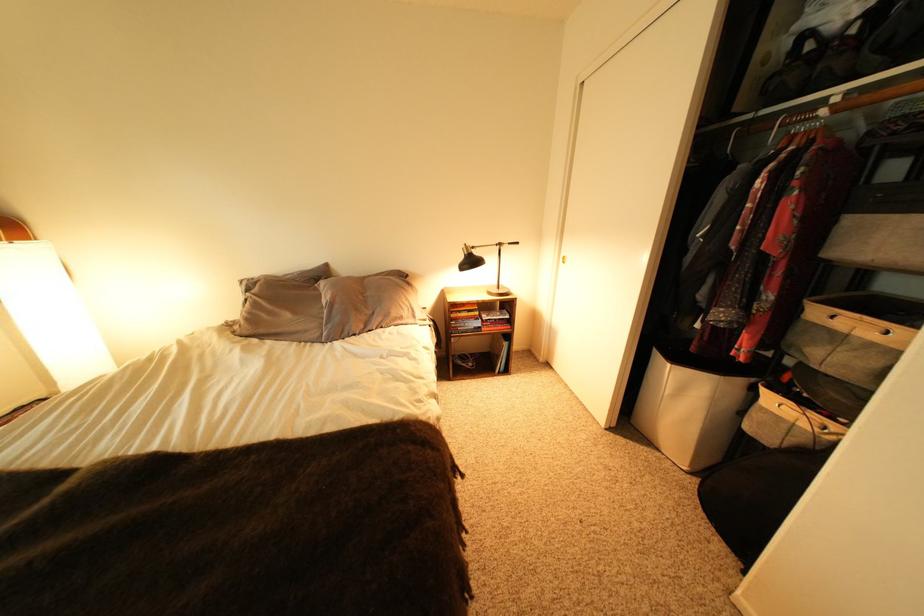
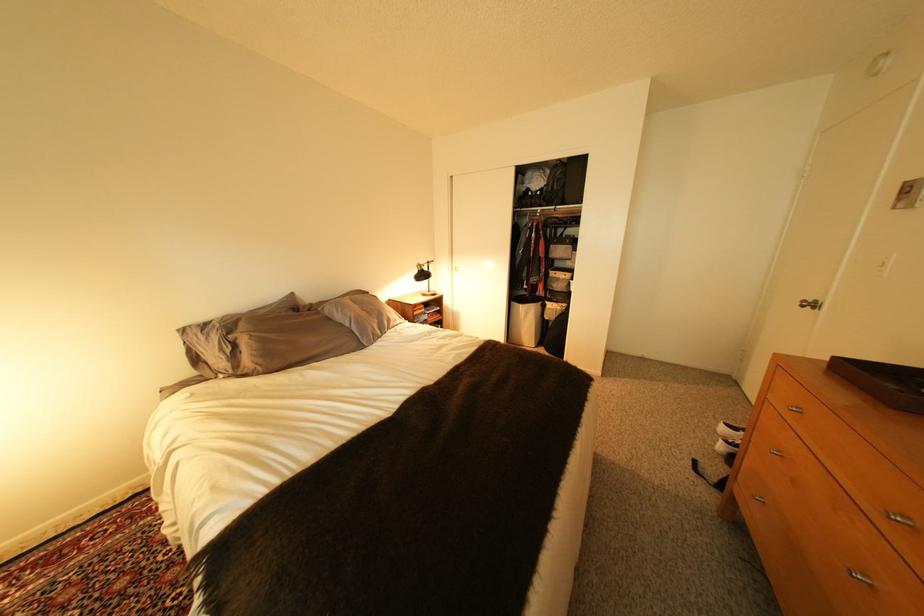
In the second image, find the point that corresponds to point (682, 367) in the first image.

(533, 307)